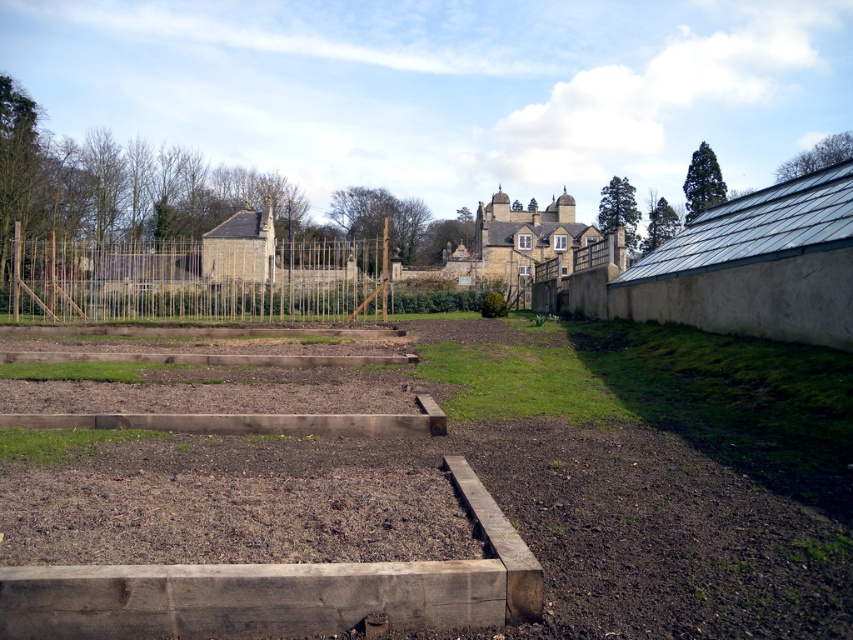
Based on the photo, you are a gardener planning to plant flowers in the brown wooden raised beds at center and the wooden fence at center. Based on their positions, which object is closer to the ground?

The brown wooden raised beds at center is closer to the ground because it is below the wooden fence at center.

You are planning to expand your garden and need to know which area takes up more space between the brown wooden raised beds at center and the wooden fence at center. Based on the scene, which one is smaller in size?

The brown wooden raised beds at center occupies less space than the wooden fence at center, so the brown wooden raised beds at center is smaller in size.